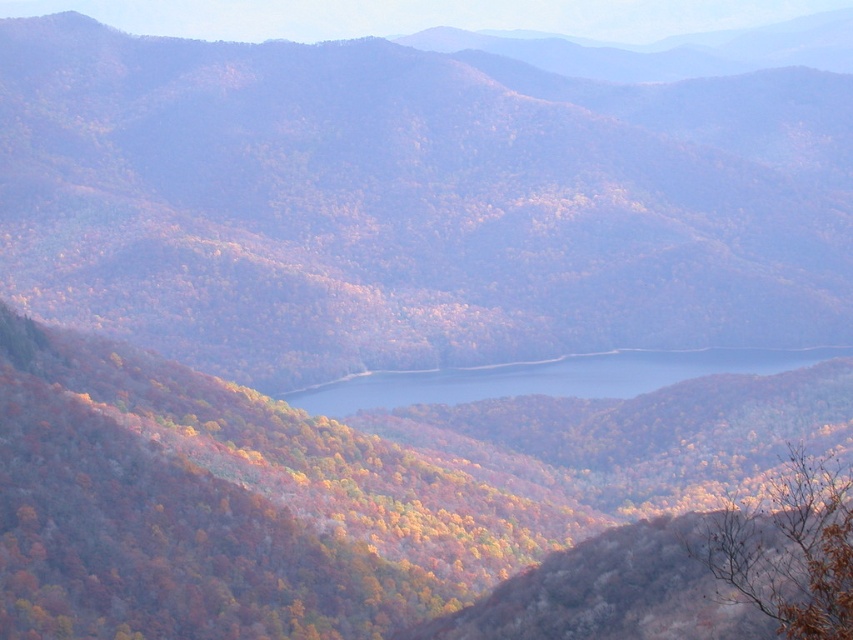
Question: Does brown matte forest at center have a lesser width compared to blue glassy water at center?

Choices:
 (A) no
 (B) yes

Answer: (A)

Question: Is brown matte forest at center thinner than blue glassy water at center?

Choices:
 (A) yes
 (B) no

Answer: (B)

Question: Estimate the real-world distances between objects in this image. Which object is farther from the blue glassy water at center?

Choices:
 (A) brown matte tree at lower right
 (B) autumn leaves at center
 (C) brown matte forest at center

Answer: (A)

Question: Which of the following is the closest to the observer?

Choices:
 (A) (134, 160)
 (B) (740, 376)

Answer: (B)

Question: Is the position of brown matte tree at lower right less distant than that of blue glassy water at center?

Choices:
 (A) yes
 (B) no

Answer: (A)

Question: Among these points, which one is nearest to the camera?

Choices:
 (A) (822, 506)
 (B) (578, 384)
 (C) (561, 240)
 (D) (732, 388)

Answer: (A)